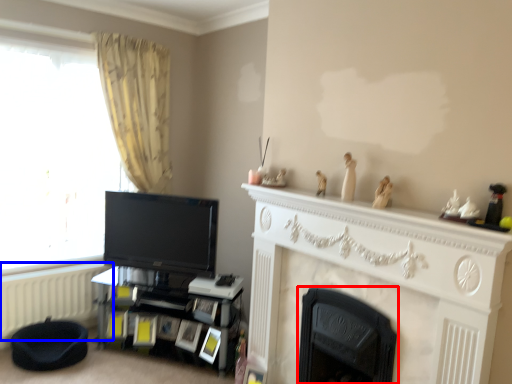
Question: Which object is further to the camera taking this photo, fireplace (highlighted by a red box) or radiator (highlighted by a blue box)?

Choices:
 (A) fireplace
 (B) radiator

Answer: (B)